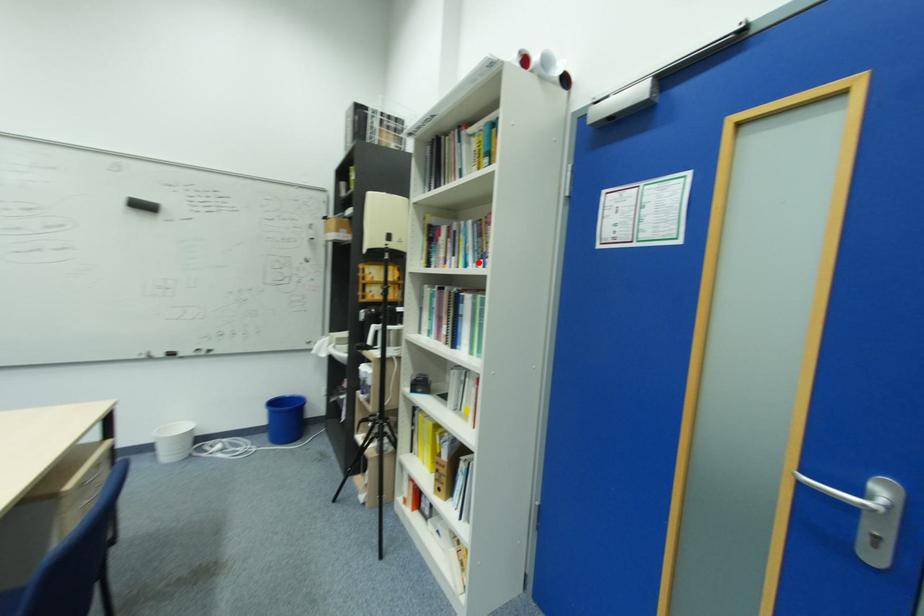
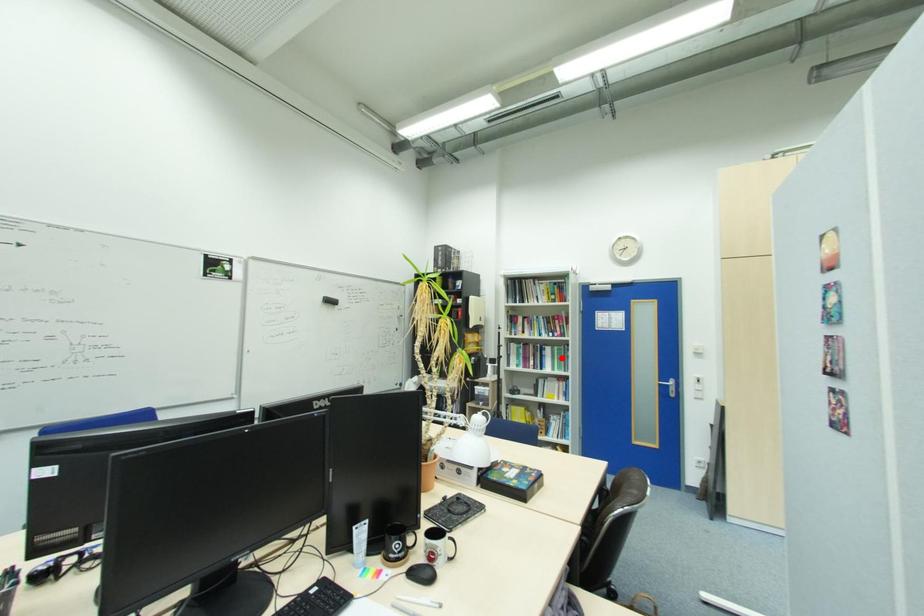
I am providing you with two images of the same scene from different viewpoints. A red point is marked on the first image and another point is marked on the second image. Does the point marked in image1 correspond to the same location as the one in image2?

No